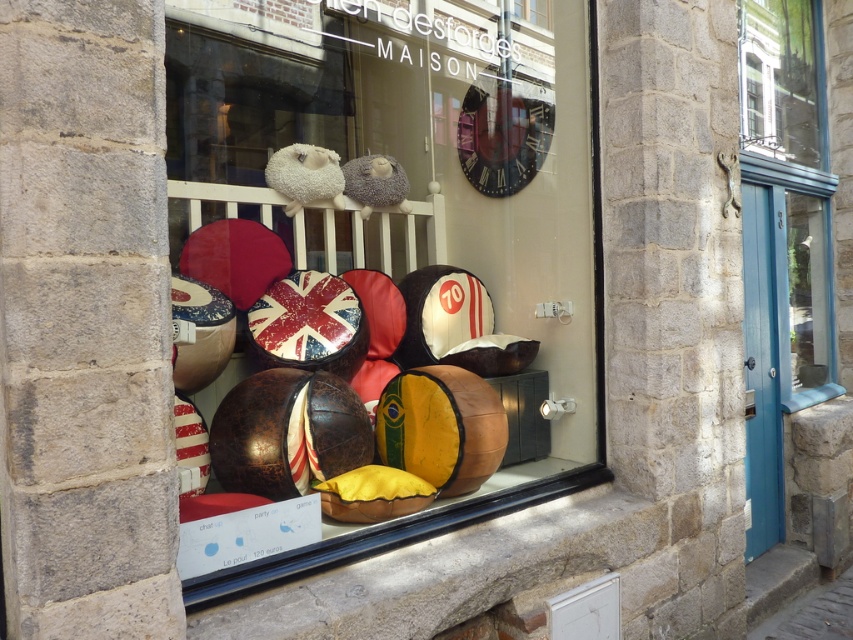
Can you confirm if leather pillows at center is bigger than blue glass door at right?

Correct, leather pillows at center is larger in size than blue glass door at right.

Is leather pillows at center smaller than blue glass door at right?

No.

At what (x,y) coordinates should I click in order to perform the action: click on leather pillows at center. Please return your answer as a coordinate pair (x, y). The width and height of the screenshot is (853, 640). Looking at the image, I should click on (380, 275).

Does blue glass door at right appear on the right side of clear glass window at upper right?

Correct, you'll find blue glass door at right to the right of clear glass window at upper right.

Between point (769, 193) and point (819, 83), which one is positioned behind?

The point (819, 83) is behind.

The image size is (853, 640). What are the coordinates of `blue glass door at right` in the screenshot? It's located at (788, 193).

From the picture: Can you confirm if blue glass door at right is positioned to the left of black leather window sill at lower center?

Incorrect, blue glass door at right is not on the left side of black leather window sill at lower center.

You are a GUI agent. You are given a task and a screenshot of the screen. Output one action in this format:
    pyautogui.click(x=<x>, y=<y>)
    Task: Click on the blue glass door at right
    The image size is (853, 640).
    Given the screenshot: What is the action you would take?
    pyautogui.click(x=788, y=193)

At what (x,y) coordinates should I click in order to perform the action: click on blue glass door at right. Please return your answer as a coordinate pair (x, y). This screenshot has width=853, height=640. Looking at the image, I should click on (788, 193).